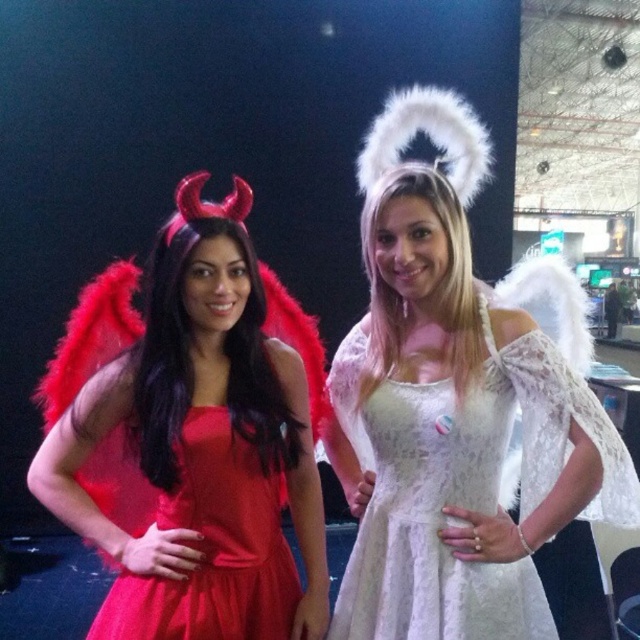
Which is below, matte red dress at left or matte red dress at center?

Positioned lower is matte red dress at center.

Between matte red dress at left and matte red dress at center, which one has less height?

With less height is matte red dress at center.

Between point (288, 554) and point (216, 520), which one is positioned behind?

Positioned behind is point (288, 554).

The image size is (640, 640). Identify the location of matte red dress at left. (195, 442).

Who is positioned more to the left, matte red dress at left or lace white dress at center?

matte red dress at left is more to the left.

Find the location of a particular element. matte red dress at left is located at coordinates (195, 442).

Find the location of a particular element. The height and width of the screenshot is (640, 640). matte red dress at left is located at coordinates (195, 442).

Does lace white dress at center have a lesser width compared to matte red dress at center?

No.

Is point (468, 620) closer to camera compared to point (292, 566)?

Yes, it is.

This screenshot has width=640, height=640. Describe the element at coordinates (461, 488) in the screenshot. I see `lace white dress at center` at that location.

Where is `lace white dress at center`? lace white dress at center is located at coordinates (461, 488).